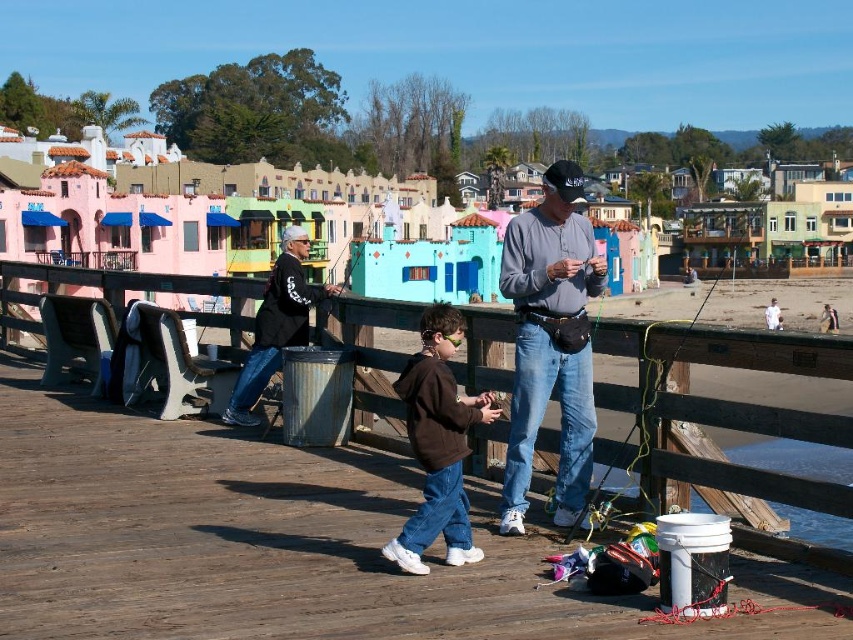
You are standing on the pier and want to place your fishing pole on the wooden rail. Based on the scene, can you tell if the green plastic fishing pole at center is above or below the wooden rail at center?

The wooden rail at center is located below the green plastic fishing pole at center, so the green plastic fishing pole at center is above the wooden rail at center.